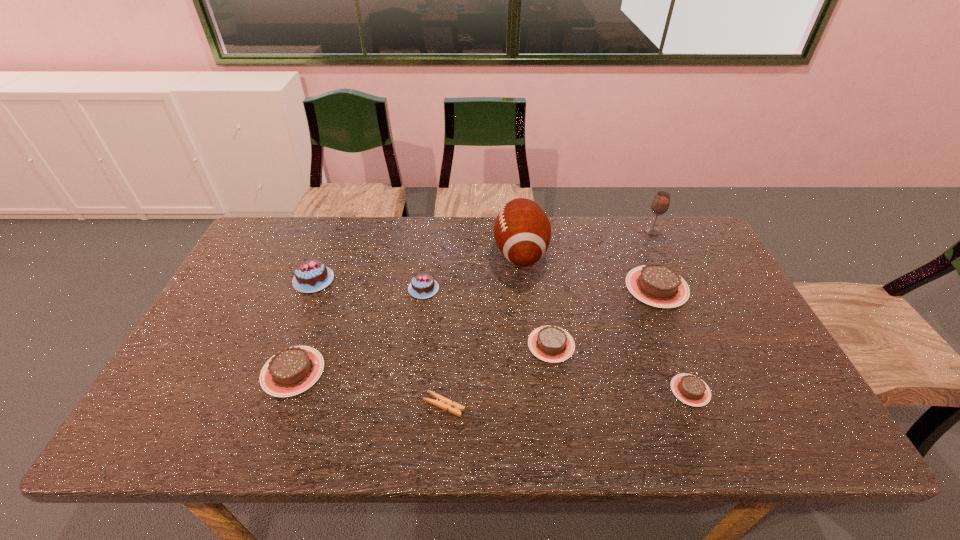
At what (x,y) coordinates should I click in order to perform the action: click on free point located on the front of the smaller pink chocolate cake. Please return your answer as a coordinate pair (x, y). The height and width of the screenshot is (540, 960). Looking at the image, I should click on (415, 357).

Locate an element on the screen. This screenshot has height=540, width=960. vacant space located 0.050m on the right of the farthest brown chocolate cake is located at coordinates (705, 287).

Identify the location of vacant space situated 0.070m on the back of the leftmost brown chocolate cake. Image resolution: width=960 pixels, height=540 pixels. (309, 326).

Locate an element on the screen. The height and width of the screenshot is (540, 960). free space located on the left of the fifth tallest chocolate cake is located at coordinates (458, 345).

Where is `vacant region located 0.060m on the right of the eighth tallest object`? The height and width of the screenshot is (540, 960). vacant region located 0.060m on the right of the eighth tallest object is located at coordinates (734, 390).

Identify the location of vacant space located on the left of the clothespin. The width and height of the screenshot is (960, 540). (327, 405).

Locate an element on the screen. Image resolution: width=960 pixels, height=540 pixels. football that is at the far edge is located at coordinates (522, 231).

Find the location of a particular element. glass drink container that is at the far edge is located at coordinates (660, 204).

What are the coordinates of `object at the near edge` in the screenshot? It's located at (441, 402).

Locate an element on the screen. glass drink container that is at the right edge is located at coordinates (660, 204).